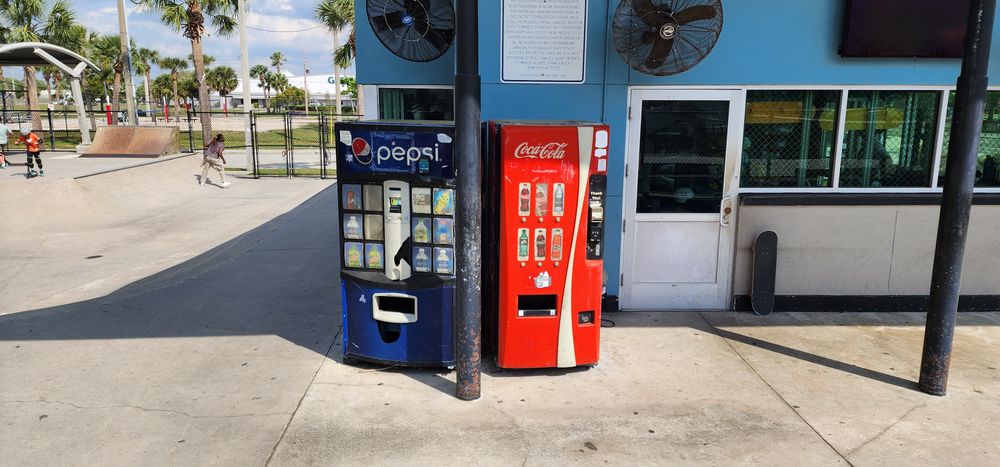
Where is `tv`? This screenshot has height=467, width=1000. tv is located at coordinates (882, 37).